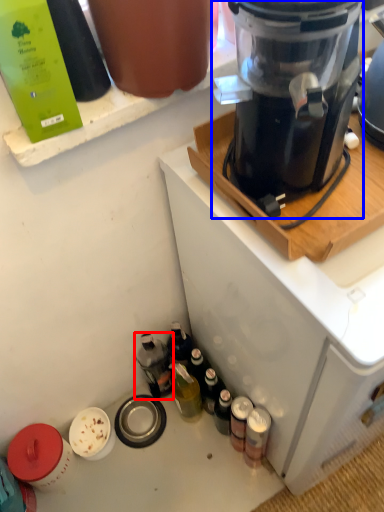
Question: Which point is further to the camera, bottle (highlighted by a red box) or blender (highlighted by a blue box)?

Choices:
 (A) bottle
 (B) blender

Answer: (A)